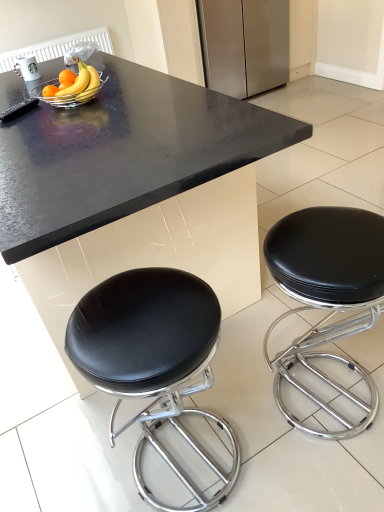
At what (x,y) coordinates should I click in order to perform the action: click on empty space that is ontop of black leather stool at lower right, the 2th stool in the left-to-right sequence (from a real-world perspective). Please return your answer as a coordinate pair (x, y). Looking at the image, I should click on (334, 254).